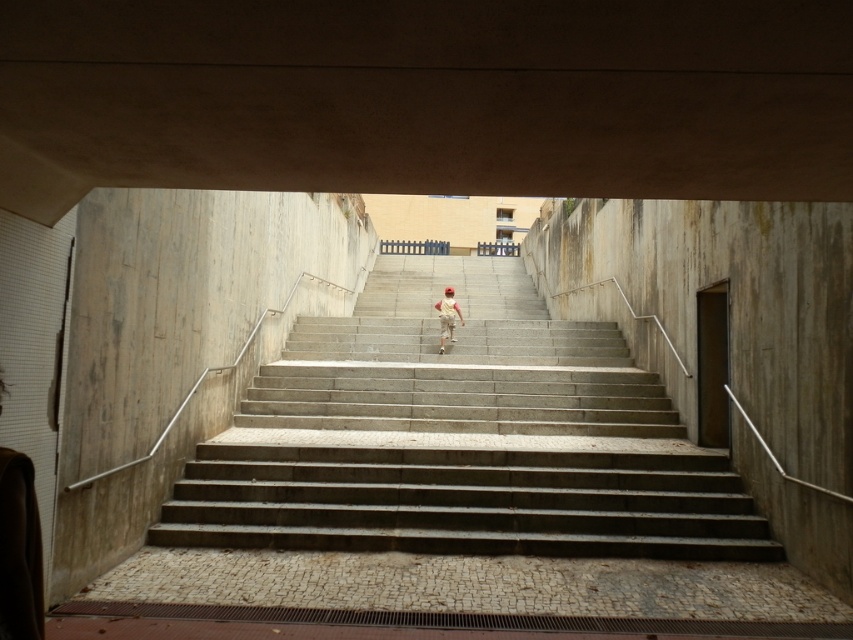
Which is behind, point (450, 449) or point (445, 289)?

Point (445, 289)

The height and width of the screenshot is (640, 853). What do you see at coordinates (460, 436) in the screenshot?
I see `concrete stairs at center` at bounding box center [460, 436].

Between point (288, 525) and point (440, 308), which one is positioned in front?

Point (288, 525)

Find the location of `concrete stairs at center`. concrete stairs at center is located at coordinates (460, 436).